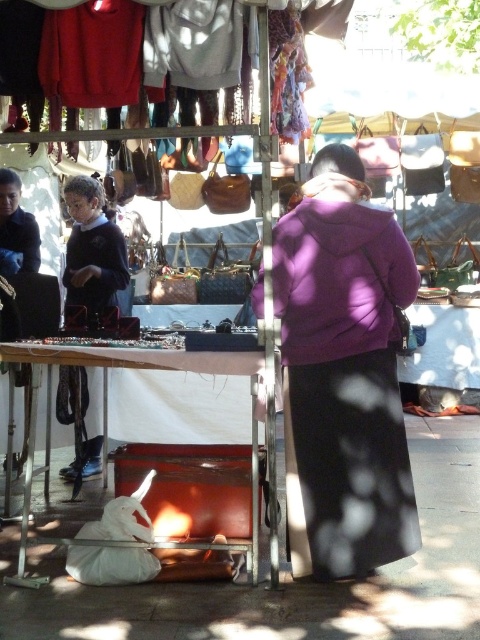
Can you confirm if purple matte jacket at center is positioned below white leather table at lower center?

Actually, purple matte jacket at center is above white leather table at lower center.

From the picture: Which of these two, purple matte jacket at center or white leather table at lower center, stands taller?

purple matte jacket at center

At what (x,y) coordinates should I click in order to perform the action: click on purple matte jacket at center. Please return your answer as a coordinate pair (x, y). This screenshot has height=640, width=480. Looking at the image, I should click on tap(344, 372).